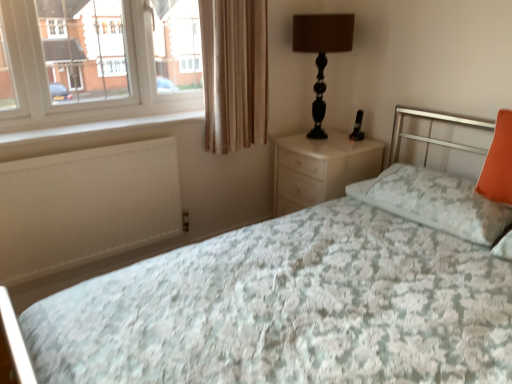
The image size is (512, 384). I want to click on blank space situated above white matte radiator at lower left (from a real-world perspective), so click(69, 144).